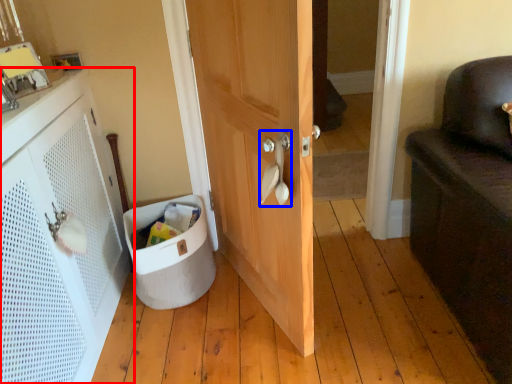
Question: Which point is further to the camera, cabinetry (highlighted by a red box) or door handle (highlighted by a blue box)?

Choices:
 (A) cabinetry
 (B) door handle

Answer: (B)